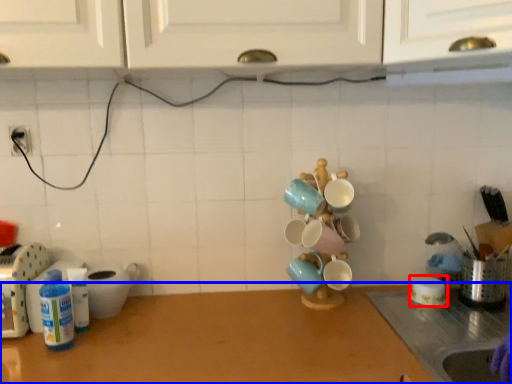
Question: Among these objects, which one is farthest to the camera, tableware (highlighted by a red box) or countertop (highlighted by a blue box)?

Choices:
 (A) tableware
 (B) countertop

Answer: (A)